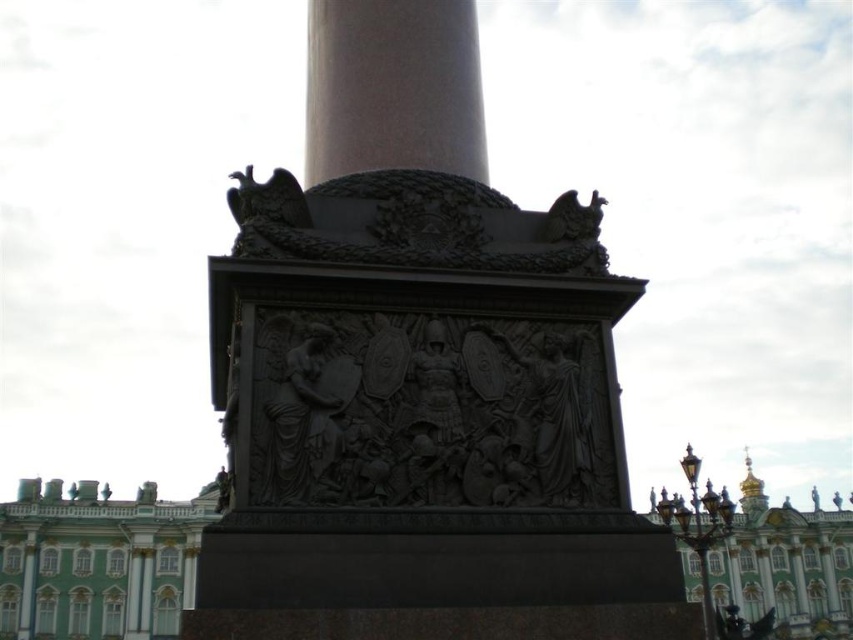
Question: Which of the following is the farthest from the observer?

Choices:
 (A) (463, 83)
 (B) (769, 524)
 (C) (13, 628)

Answer: (B)

Question: Among these objects, which one is nearest to the camera?

Choices:
 (A) smooth bronze column at center
 (B) green polished stone palace at lower left
 (C) gold domed palace at center

Answer: (A)

Question: Can you confirm if smooth bronze column at center is positioned to the left of green polished stone palace at lower left?

Choices:
 (A) no
 (B) yes

Answer: (A)

Question: Which point is closer to the camera taking this photo?

Choices:
 (A) (178, 582)
 (B) (372, 92)
 (C) (793, 579)

Answer: (B)

Question: Does smooth bronze column at center come behind gold domed palace at center?

Choices:
 (A) no
 (B) yes

Answer: (A)

Question: Can you confirm if black bas-relief sculpture at center is positioned above green polished stone palace at lower left?

Choices:
 (A) no
 (B) yes

Answer: (B)